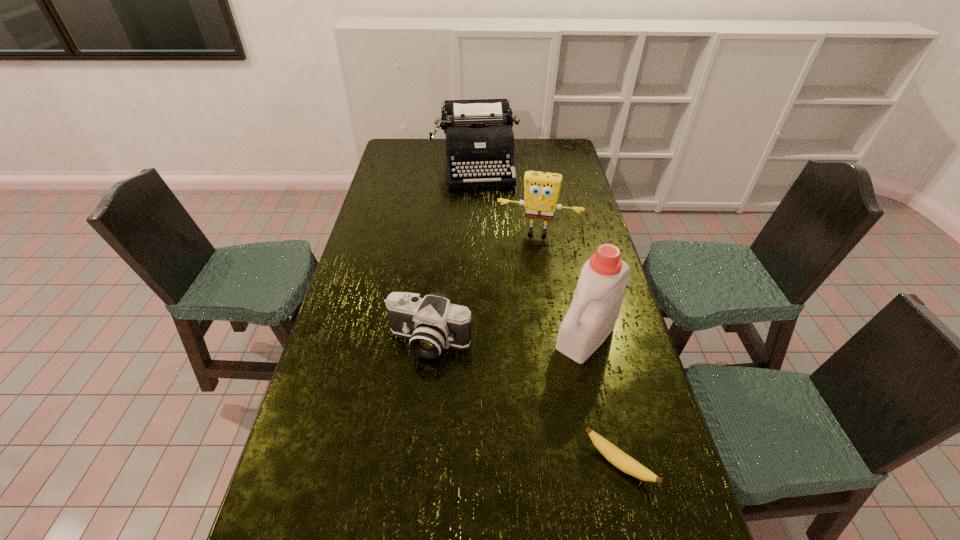
You are a GUI agent. You are given a task and a screenshot of the screen. Output one action in this format:
    pyautogui.click(x=<x>, y=<y>)
    Task: Click on the camera
    
    Given the screenshot: What is the action you would take?
    pyautogui.click(x=432, y=323)

Locate an element on the screen. The width and height of the screenshot is (960, 540). the nearest object is located at coordinates (613, 454).

Where is `banana`? The height and width of the screenshot is (540, 960). banana is located at coordinates (613, 454).

This screenshot has width=960, height=540. I want to click on sponge, so click(x=541, y=189).

Locate an element on the screen. The height and width of the screenshot is (540, 960). the farthest object is located at coordinates (479, 137).

Find the location of a particular element. Image resolution: width=960 pixels, height=540 pixels. the tallest object is located at coordinates (591, 317).

Where is `free location located 0.060m on the left of the camera`? free location located 0.060m on the left of the camera is located at coordinates (367, 341).

The image size is (960, 540). Identify the location of free space located 0.270m on the back of the shortest object. [x=592, y=350].

Find the location of a particular element. free space located 0.390m on the face of the second farthest object is located at coordinates (517, 314).

Identify the location of free location located on the face of the second farthest object. The width and height of the screenshot is (960, 540). (527, 260).